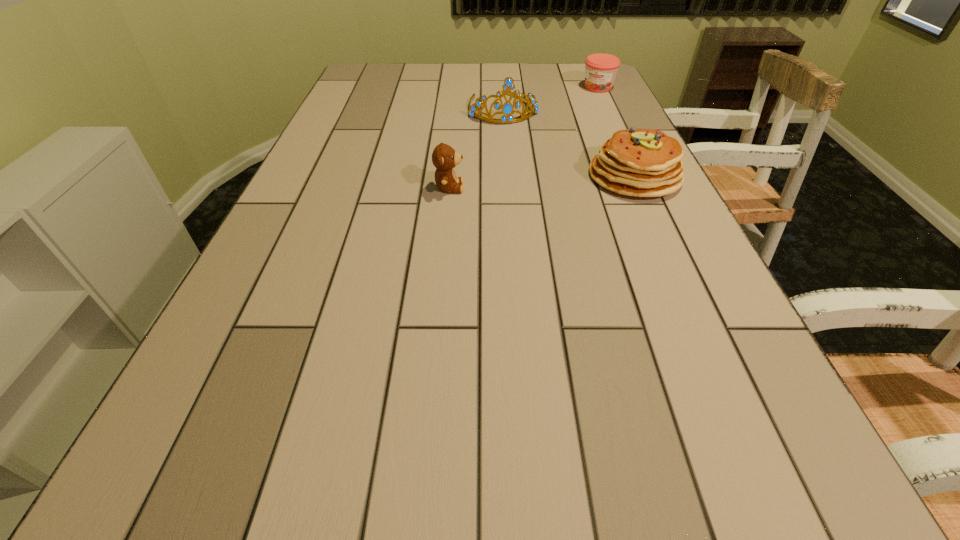
Identify the location of free space on the desktop that is between the leftmost object and the pancake and is positioned on the front label of the shortest object. This screenshot has width=960, height=540. (521, 183).

The height and width of the screenshot is (540, 960). In order to click on free spot on the desktop that is between the leftmost object and the pancake and is positioned on the front-facing side of the tiara in this screenshot , I will do `click(530, 183)`.